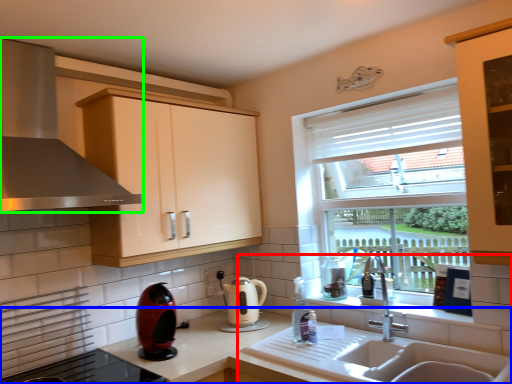
Question: Considering the real-world distances, which object is farthest from sink (highlighted by a red box)? countertop (highlighted by a blue box) or home appliance (highlighted by a green box)?

Choices:
 (A) countertop
 (B) home appliance

Answer: (B)